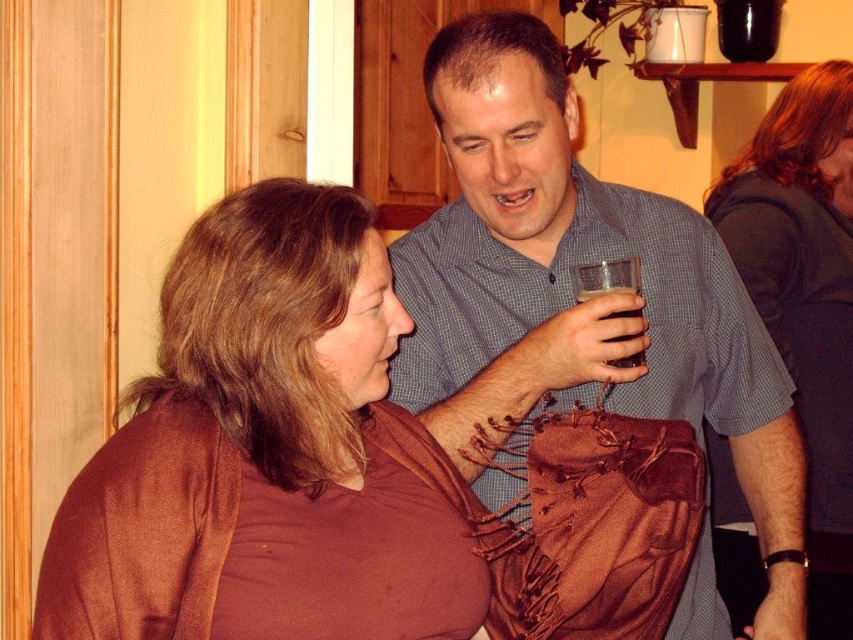
Question: Can you confirm if blue checkered shirt at center is positioned below dark gray fabric at upper right?

Choices:
 (A) no
 (B) yes

Answer: (B)

Question: Observing the image, what is the correct spatial positioning of dark gray fabric at upper right in reference to clear glass at upper right?

Choices:
 (A) left
 (B) right

Answer: (B)

Question: Estimate the real-world distances between objects in this image. Which object is closer to the dark gray fabric at upper right?

Choices:
 (A) blue checkered shirt at center
 (B) brown fabric scarf at center
 (C) clear glass at upper right

Answer: (A)

Question: Which of the following is the farthest from the observer?

Choices:
 (A) brown fabric scarf at center
 (B) dark gray fabric at upper right

Answer: (B)

Question: Among these objects, which one is nearest to the camera?

Choices:
 (A) blue checkered shirt at center
 (B) dark gray fabric at upper right
 (C) clear glass at upper right
 (D) brown fabric scarf at center

Answer: (D)

Question: Considering the relative positions of brown fabric scarf at center and dark gray fabric at upper right in the image provided, where is brown fabric scarf at center located with respect to dark gray fabric at upper right?

Choices:
 (A) right
 (B) left

Answer: (B)